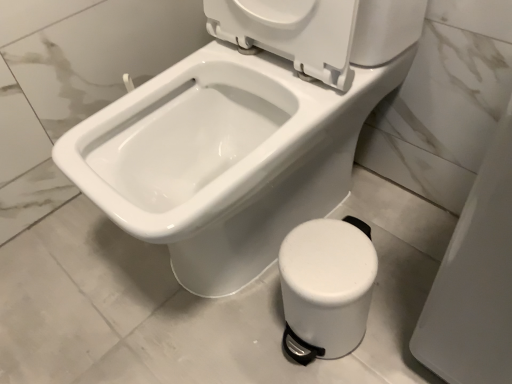
Identify the location of white plastic pedal bin at lower right. (326, 287).

The width and height of the screenshot is (512, 384). Describe the element at coordinates (326, 287) in the screenshot. I see `white plastic pedal bin at lower right` at that location.

In order to face white plastic pedal bin at lower right, should I rotate leftwards or rightwards?

Rotate your view right by about 9.220°.

Find the location of `white glossy bidet at center`. white glossy bidet at center is located at coordinates (223, 158).

What do you see at coordinates (223, 158) in the screenshot? I see `white glossy bidet at center` at bounding box center [223, 158].

Identify the location of white plastic pedal bin at lower right. This screenshot has width=512, height=384. (326, 287).

Which object is positioned more to the right, white plastic pedal bin at lower right or white glossy bidet at center?

white plastic pedal bin at lower right is more to the right.

Which is in front, white plastic pedal bin at lower right or white glossy bidet at center?

white glossy bidet at center is more forward.

Which is closer to the camera, (291, 248) or (197, 241)?

Point (291, 248)

From the image's perspective, does white plastic pedal bin at lower right appear lower than white glossy bidet at center?

Yes, from the image's perspective, white plastic pedal bin at lower right is beneath white glossy bidet at center.

From a real-world perspective, is white plastic pedal bin at lower right positioned under white glossy bidet at center based on gravity?

Indeed, from a real-world perspective, white plastic pedal bin at lower right is positioned beneath white glossy bidet at center.

Does white plastic pedal bin at lower right have a greater width compared to white glossy bidet at center?

Incorrect, the width of white plastic pedal bin at lower right does not surpass that of white glossy bidet at center.

Based on the photo, considering the sizes of objects white plastic pedal bin at lower right and white glossy bidet at center in the image provided, who is shorter, white plastic pedal bin at lower right or white glossy bidet at center?

white plastic pedal bin at lower right is shorter.

Does white plastic pedal bin at lower right have a smaller size compared to white glossy bidet at center?

Yes, white plastic pedal bin at lower right is smaller than white glossy bidet at center.

Is white plastic pedal bin at lower right spatially inside white glossy bidet at center, or outside of it?

The correct answer is: outside.

Is white plastic pedal bin at lower right beside white glossy bidet at center?

No, white plastic pedal bin at lower right is not next to white glossy bidet at center.

Is white plastic pedal bin at lower right facing away from white glossy bidet at center?

white plastic pedal bin at lower right is not turned away from white glossy bidet at center.

Find the location of a particular element. This screenshot has width=512, height=384. bidet in front of the white plastic pedal bin at lower right is located at coordinates (223, 158).

Can you confirm if white glossy bidet at center is positioned to the left of white plastic pedal bin at lower right?

Yes, white glossy bidet at center is to the left of white plastic pedal bin at lower right.

Based on the photo, considering the positions of objects white glossy bidet at center and white plastic pedal bin at lower right in the image provided, who is behind, white glossy bidet at center or white plastic pedal bin at lower right?

white plastic pedal bin at lower right.

Which is in front, point (210, 230) or point (341, 306)?

The point (341, 306) is closer to the camera.

From the image's perspective, is white glossy bidet at center beneath white plastic pedal bin at lower right?

Actually, white glossy bidet at center appears above white plastic pedal bin at lower right in the image.

From a real-world perspective, does white glossy bidet at center stand above white plastic pedal bin at lower right?

Yes, from a real-world perspective, white glossy bidet at center is on top of white plastic pedal bin at lower right.

Considering the relative sizes of white glossy bidet at center and white plastic pedal bin at lower right in the image provided, is white glossy bidet at center wider than white plastic pedal bin at lower right?

Yes.

Which of these two, white glossy bidet at center or white plastic pedal bin at lower right, stands taller?

white glossy bidet at center.

Is white glossy bidet at center bigger than white plastic pedal bin at lower right?

Correct, white glossy bidet at center is larger in size than white plastic pedal bin at lower right.

Would you say white plastic pedal bin at lower right is part of white glossy bidet at center's contents?

No, white plastic pedal bin at lower right is not inside white glossy bidet at center.

Is white glossy bidet at center in contact with white plastic pedal bin at lower right?

No, white glossy bidet at center is not with white plastic pedal bin at lower right.

Is white glossy bidet at center oriented towards white plastic pedal bin at lower right?

No, white glossy bidet at center is not turned towards white plastic pedal bin at lower right.

How distant is white glossy bidet at center from white plastic pedal bin at lower right?

white glossy bidet at center and white plastic pedal bin at lower right are 9.38 inches apart.

Find the location of a particular element. toilet located underneath the white glossy bidet at center (from a real-world perspective) is located at coordinates (326, 287).

I want to click on toilet below the white glossy bidet at center (from a real-world perspective), so click(x=326, y=287).

Locate an element on the screen. toilet that appears behind the white glossy bidet at center is located at coordinates (326, 287).